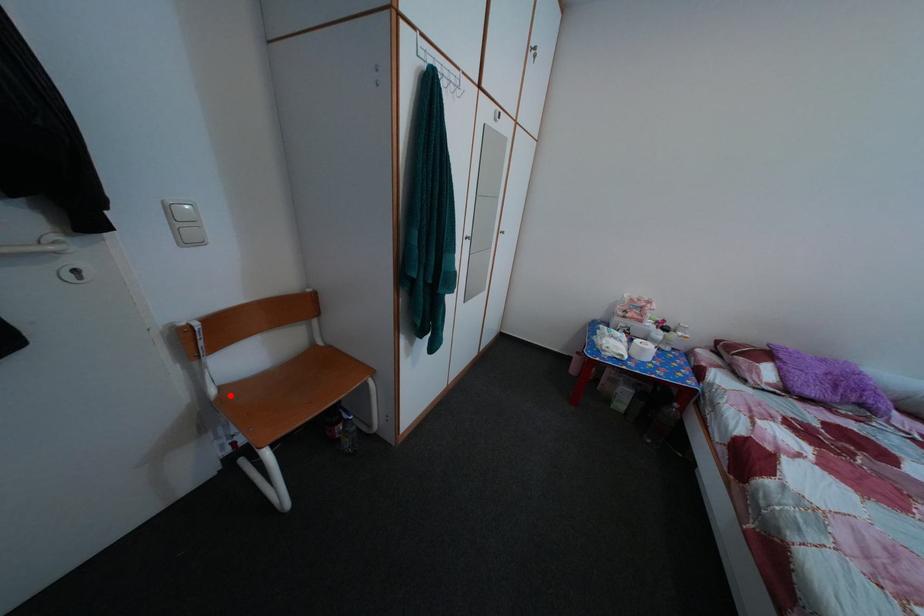
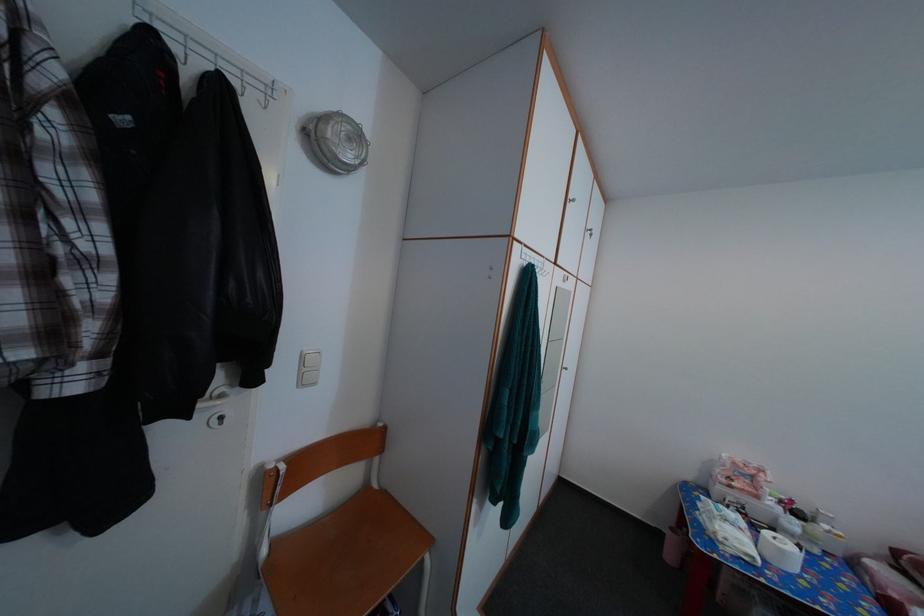
The point at the highlighted location is marked in the first image. Where is the corresponding point in the second image?

(282, 552)